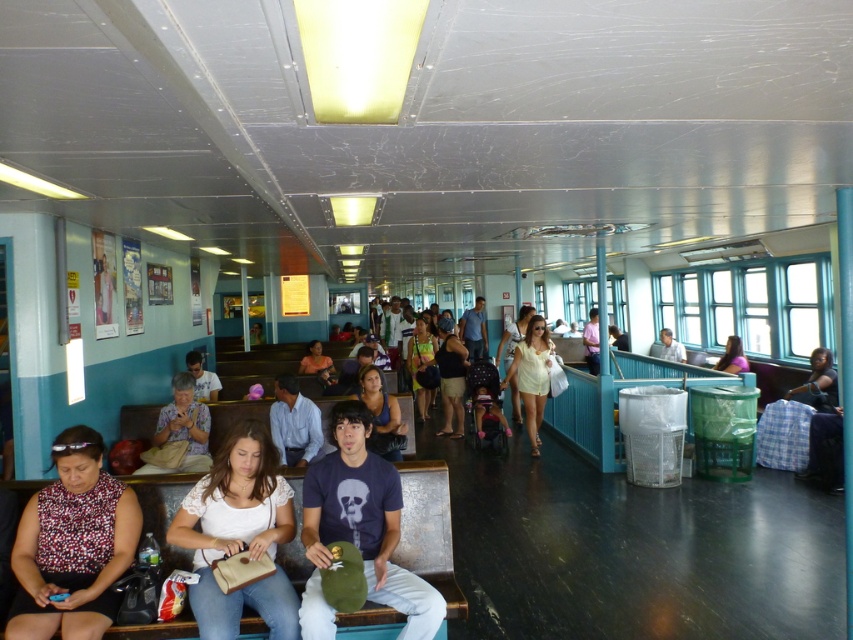
Is matte black t-shirt at center to the right of pink fabric shirt at upper right from the viewer's perspective?

In fact, matte black t-shirt at center is to the left of pink fabric shirt at upper right.

Which is below, matte black t-shirt at center or pink fabric shirt at upper right?

Positioned lower is matte black t-shirt at center.

Is point (367, 573) positioned in front of point (727, 362)?

Yes.

Identify the location of matte black t-shirt at center. (358, 529).

Does printed fabric blouse at lower left appear over white fabric purse at center?

Yes, printed fabric blouse at lower left is above white fabric purse at center.

Is printed fabric blouse at lower left smaller than white fabric purse at center?

Yes.

Which is behind, point (79, 465) or point (222, 515)?

Positioned behind is point (222, 515).

Find the location of `printed fabric blouse at lower left`. printed fabric blouse at lower left is located at coordinates (73, 545).

Describe the element at coordinates (239, 532) in the screenshot. I see `white fabric purse at center` at that location.

Can you confirm if white fabric purse at center is positioned to the right of white matte dress at center?

Incorrect, white fabric purse at center is not on the right side of white matte dress at center.

Where is `white fabric purse at center`? The height and width of the screenshot is (640, 853). white fabric purse at center is located at coordinates (239, 532).